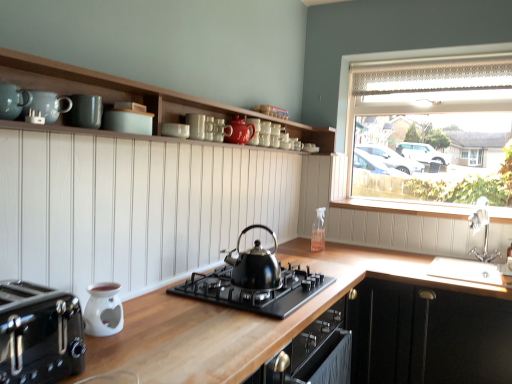
Find the location of `vacant area that is in front of white ceramic oil burner at lower left, which appears as the 2th kitchen appliance when viewed from the front`. vacant area that is in front of white ceramic oil burner at lower left, which appears as the 2th kitchen appliance when viewed from the front is located at coordinates (106, 352).